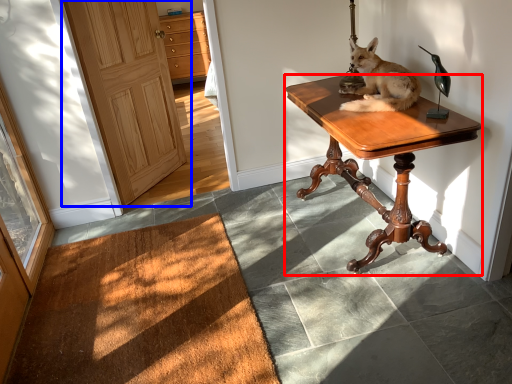
Question: Among these objects, which one is farthest to the camera, desk (highlighted by a red box) or door (highlighted by a blue box)?

Choices:
 (A) desk
 (B) door

Answer: (B)